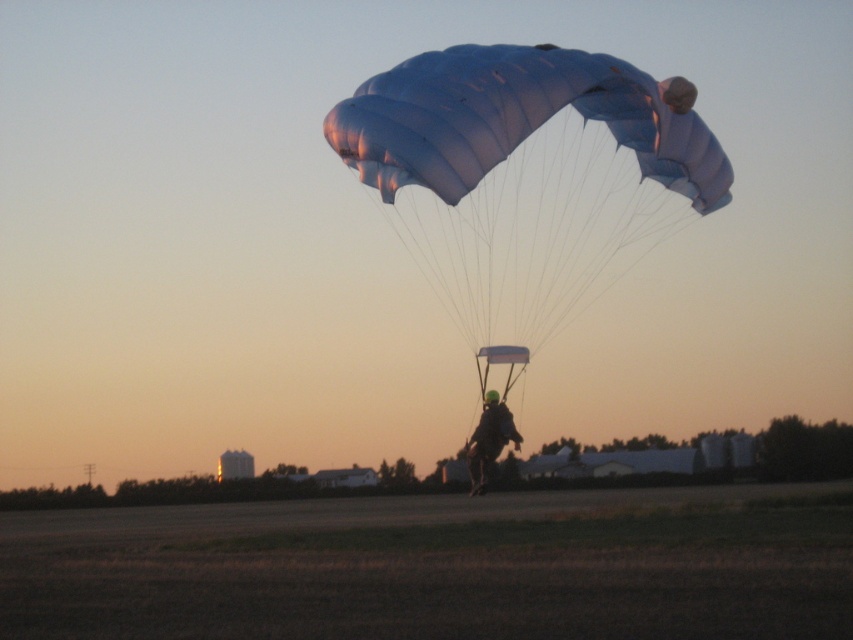
You are a photographer capturing the parachutist against the sunset. You notice a point marked at coordinates (527, 177). Based on the scene, where is this point located?

The point at coordinates (527, 177) is located on the translucent nylon parachute at upper center.

You are a photographer trying to capture the parachutist against the sunset. You notice the translucent nylon parachute at upper center and the matte black helmet at center. Which object will reflect more light and why?

The translucent nylon parachute at upper center will reflect more light because it is positioned over the matte black helmet at center, allowing it to catch more sunlight and create a reflective surface.

You are an aerial photographer capturing the parachutist against the sunset. You notice two points on the parachute, one at point coordinates point (x=547, y=225) and another at point coordinates point (x=473, y=465). Which point is closer to your camera lens?

Point (x=547, y=225) is further to the viewer than point (x=473, y=465), so the point closer to the camera lens is point (x=473, y=465).